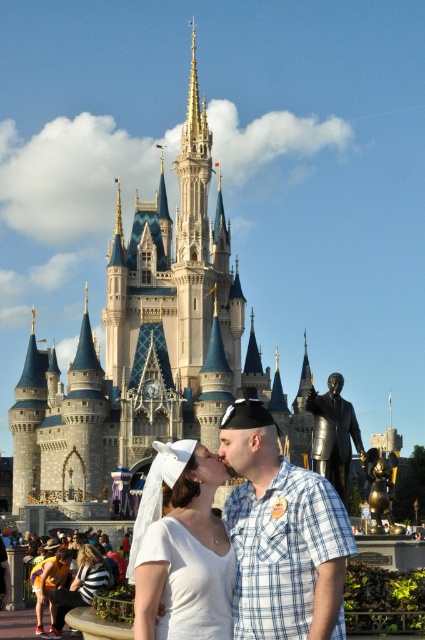
You are a photographer at Disney World and want to capture a photo of the blue plaid shirt at center and the white fabric veil at center. Which object should you focus on first if you want to ensure both are in the frame without moving the camera?

You should focus on the blue plaid shirt at center first because it is larger in size than the white fabric veil at center, making it easier to center and frame properly before adjusting for the smaller object.

You are standing at point (147, 352) in the scene. What object is located at this point?

The golden stone castle at upper center is located at point (147, 352).

You are standing at the point marked as point (147, 352) in the image. What iconic structure is directly in front of you?

The golden stone castle at upper center is located at point (147, 352), so the iconic structure directly in front of you is the golden stone castle at upper center.